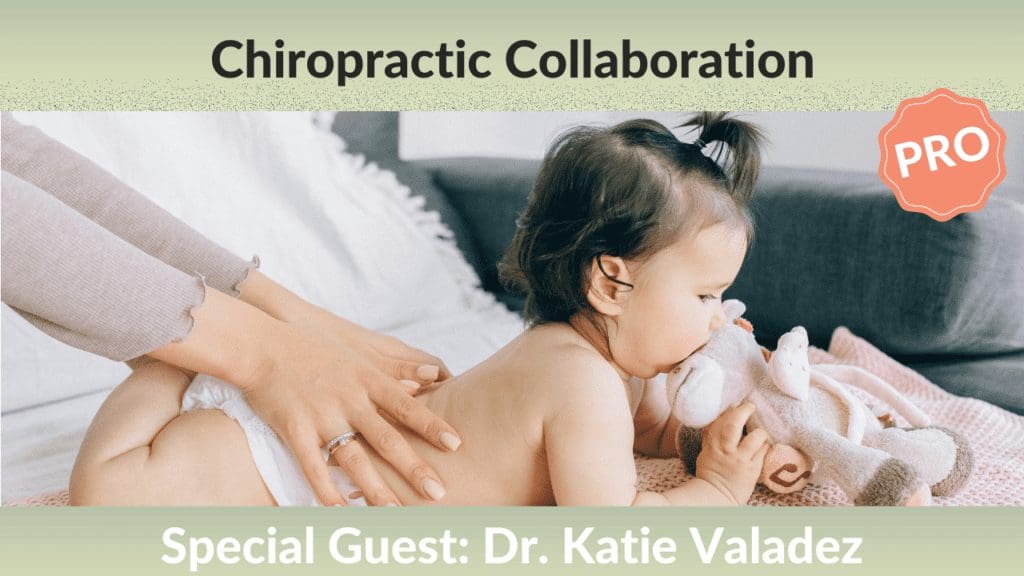
I want to click on couch cushion, so click(x=822, y=256), click(x=490, y=185).